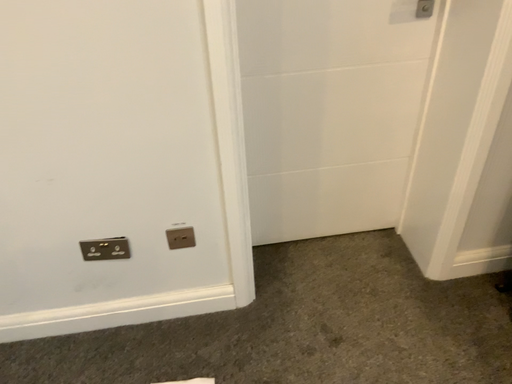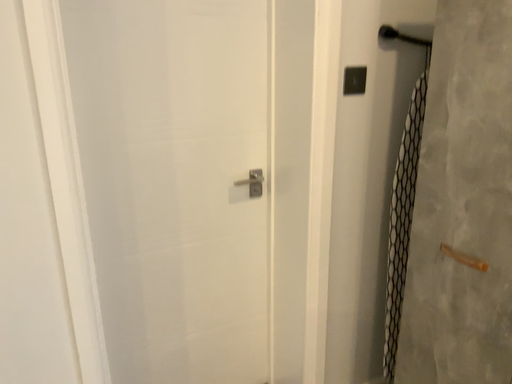
Question: How did the camera likely rotate when shooting the video?

Choices:
 (A) rotated downward
 (B) rotated upward

Answer: (B)